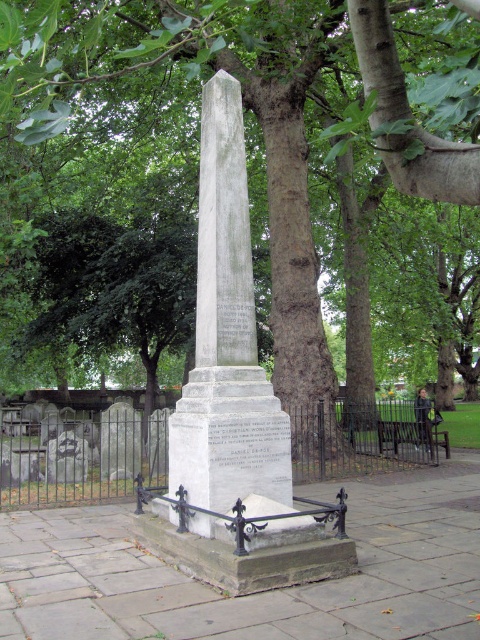
Question: Can you confirm if green leafy tree at center is positioned above white marble obelisk at center?

Choices:
 (A) yes
 (B) no

Answer: (A)

Question: Can you confirm if green leafy tree at center is positioned to the left of wooden park bench at center?

Choices:
 (A) yes
 (B) no

Answer: (A)

Question: Among these points, which one is farthest from the camera?

Choices:
 (A) (200, 480)
 (B) (322, 326)

Answer: (B)

Question: Which point is farther from the camera taking this photo?

Choices:
 (A) (416, 426)
 (B) (193, 211)
 (C) (203, 134)

Answer: (B)

Question: Considering the real-world distances, which object is closest to the green leafy tree at center?

Choices:
 (A) white marble obelisk at center
 (B) wooden park bench at center

Answer: (A)

Question: Is green leafy tree at center positioned in front of white marble obelisk at center?

Choices:
 (A) yes
 (B) no

Answer: (A)